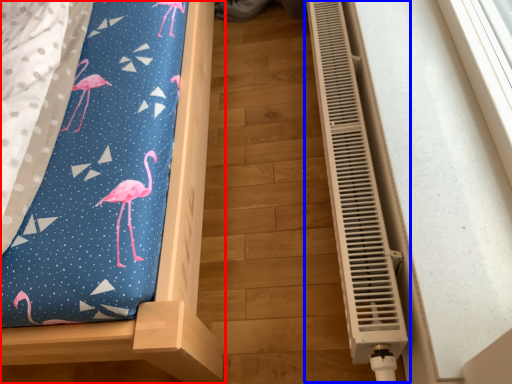
Question: Which object is further to the camera taking this photo, furniture (highlighted by a red box) or air conditioning (highlighted by a blue box)?

Choices:
 (A) furniture
 (B) air conditioning

Answer: (B)